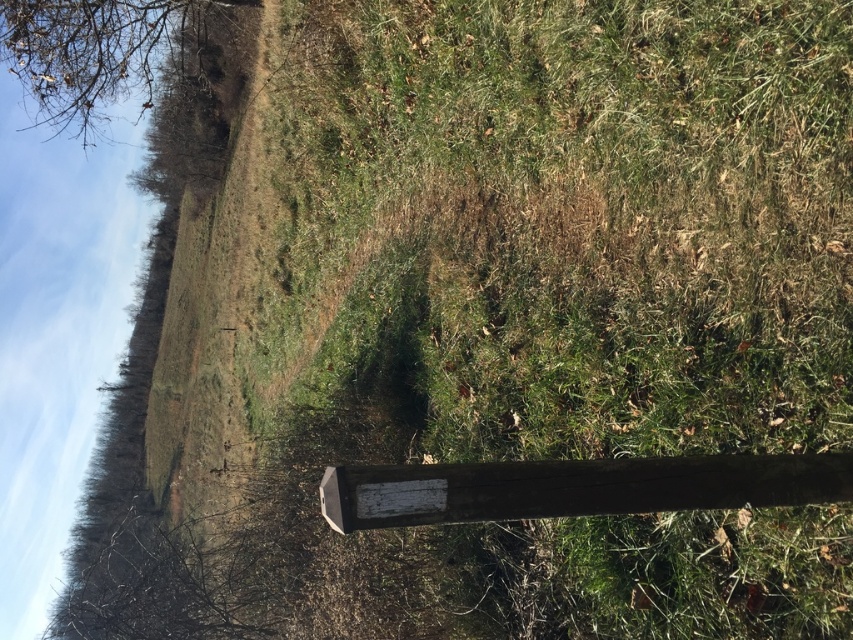
You are a hiker trying to determine which object takes up more space in the image. Based on the scene, which one is larger between the weathered wood signpost at lower center and the brown bark tree at upper left?

The brown bark tree at upper left takes up more space in the image than the weathered wood signpost at lower center because the weathered wood signpost at lower center occupies less space than brown bark tree at upper left.